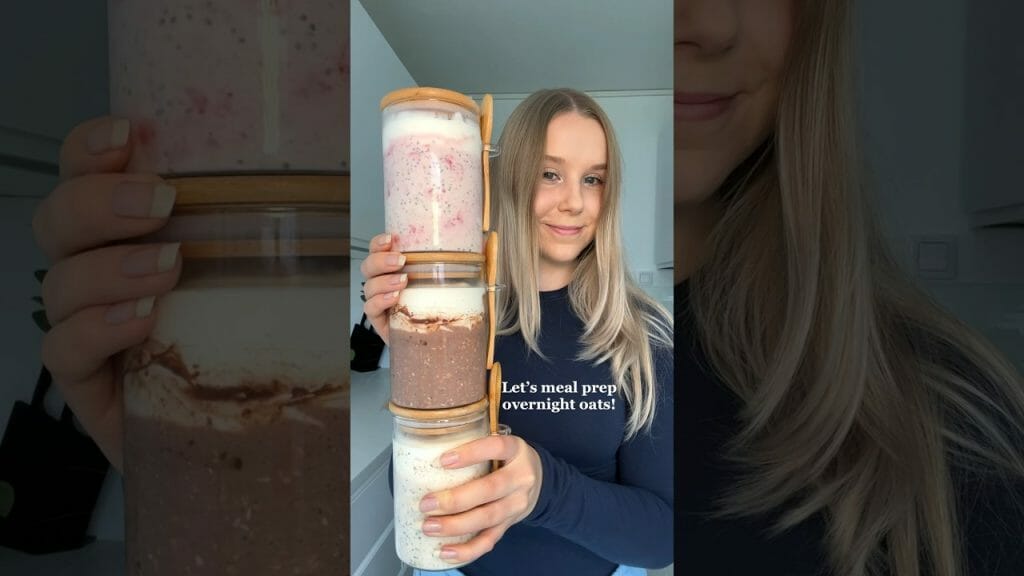
Locate an element on the screen. white ceiling is located at coordinates coord(529,36).